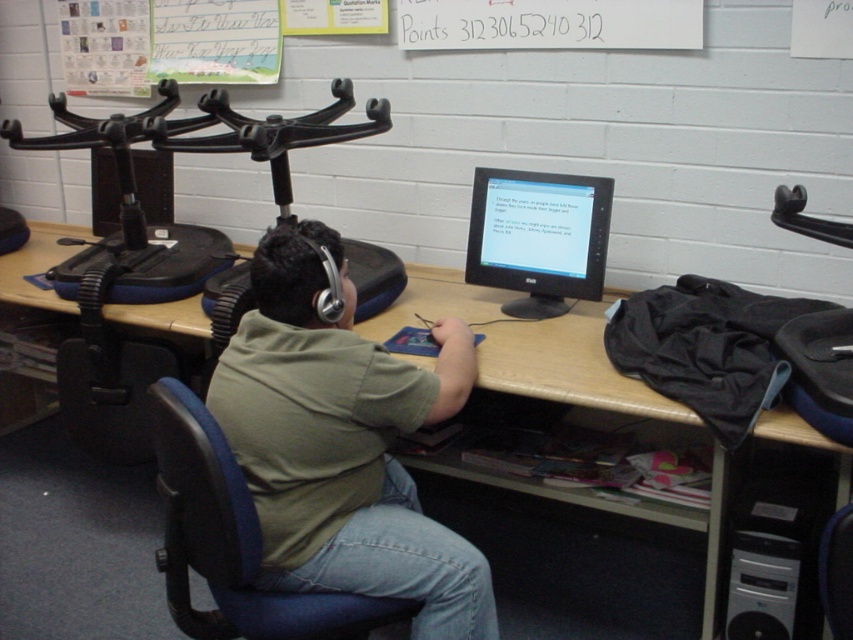
You are a classroom assistant who needs to place a new poster on the wall. The poster is 1 meter tall. The green cotton shirt at center and the white plastic computer tower at lower right are in your way. Which object do you need to move to make space for the poster?

The green cotton shirt at center is above the white plastic computer tower at lower right. To place the 1 meter tall poster, you would need to move the green cotton shirt at center since it is positioned higher up and blocking the space above the computer tower.

You are a student who wants to sit down at the desk. There is a blue fabric swivel chair at center and a black matte monitor at center. Which object should you move closer to the desk to sit?

The blue fabric swivel chair at center is to the left of the black matte monitor at center, so you should move the blue fabric swivel chair at center closer to the desk to sit.

You are a student who wants to adjust the height of your blue fabric swivel chair at center to ensure comfortable viewing of the black matte monitor at center. Based on their positions, which direction should you move the chair to align it properly with the monitor?

The blue fabric swivel chair at center is positioned under the black matte monitor at center, so to align it properly, you should move the chair upward to match the monitor height.